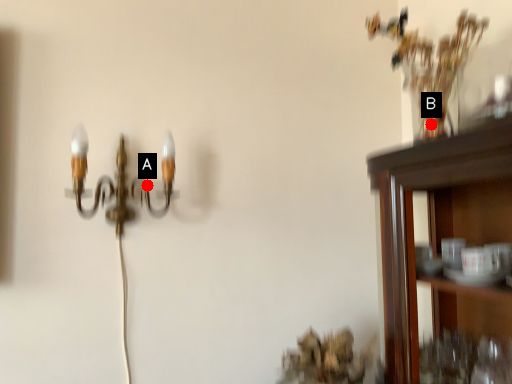
Question: Two points are circled on the image, labeled by A and B beside each circle. Among these points, which one is farthest from the camera?

Choices:
 (A) A is further
 (B) B is further

Answer: (A)